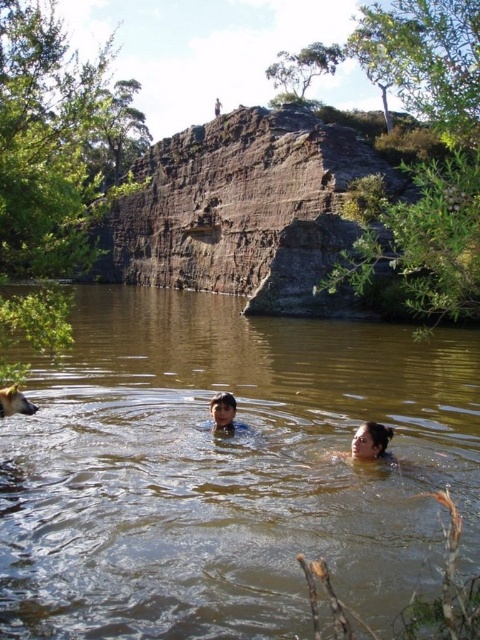
Between brown murky water at center and smooth skin face at lower center, which one has more height?

brown murky water at center is taller.

Does brown murky water at center have a greater width compared to smooth skin face at lower center?

Yes.

Is point (417, 547) farther from viewer compared to point (382, 435)?

No, (417, 547) is in front of (382, 435).

Where is `brown murky water at center`? brown murky water at center is located at coordinates (228, 470).

Does smooth skin face at lower center have a lesser width compared to golden fur dog at lower left?

No.

Which of these two, smooth skin face at lower center or golden fur dog at lower left, stands taller?

smooth skin face at lower center

Where is `smooth skin face at lower center`? smooth skin face at lower center is located at coordinates (370, 442).

Locate an element on the screen. smooth skin face at lower center is located at coordinates tap(370, 442).

Does point (230, 404) come closer to viewer compared to point (27, 410)?

That is False.

Looking at this image, between smooth skin face at center and golden fur dog at lower left, which one is positioned lower?

Positioned lower is smooth skin face at center.

Locate an element on the screen. smooth skin face at center is located at coordinates (225, 413).